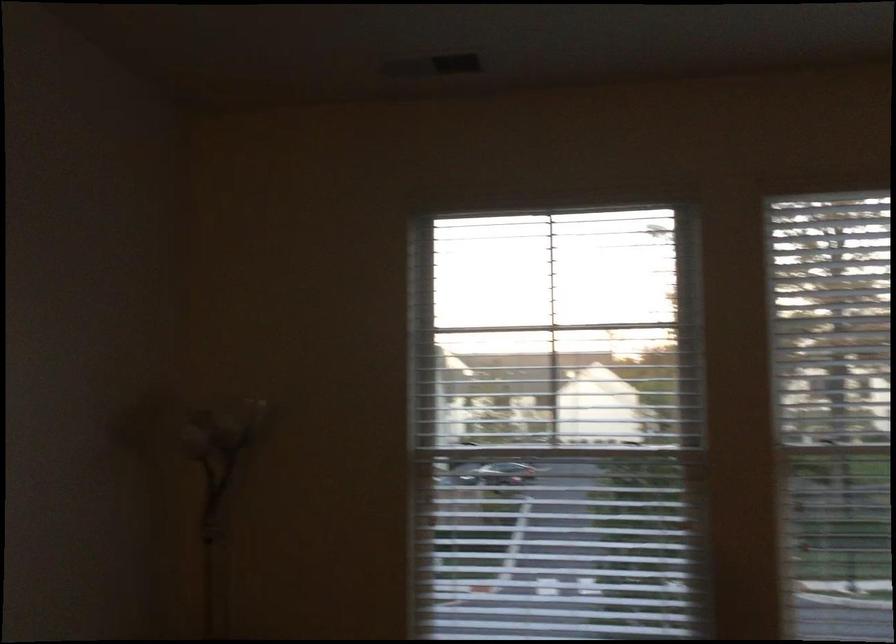
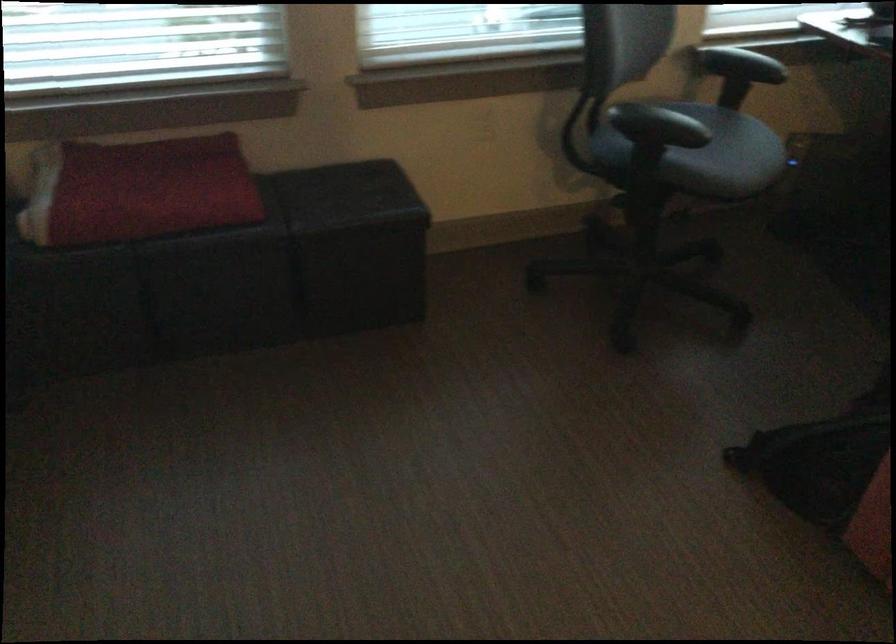
How did the camera likely rotate?

The rotation direction of the camera is right-down.